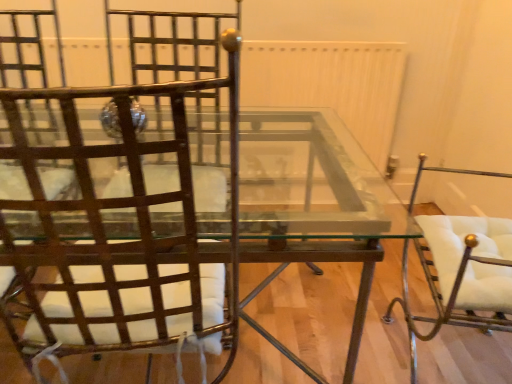
Question: Considering the positions of clear glass table at center and metallic brown chair at left, marked as the 1th chair in a left-to-right arrangement, in the image, is clear glass table at center wider or thinner than metallic brown chair at left, marked as the 1th chair in a left-to-right arrangement,?

Choices:
 (A) thin
 (B) wide

Answer: (B)

Question: Considering their positions, is clear glass table at center located in front of or behind metallic brown chair at left, acting as the second chair starting from the right?

Choices:
 (A) front
 (B) behind

Answer: (B)

Question: Which of these objects is positioned closest to the white leather chair at right, which is counted as the first chair, starting from the right?

Choices:
 (A) metallic brown chair at left, acting as the second chair starting from the right
 (B) clear glass table at center

Answer: (B)

Question: Considering the real-world distances, which object is farthest from the metallic brown chair at left, acting as the second chair starting from the right?

Choices:
 (A) white leather chair at right, which is counted as the second chair, starting from the left
 (B) clear glass table at center

Answer: (A)